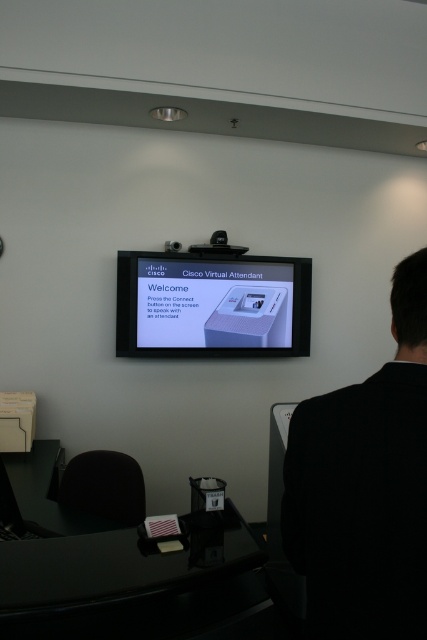
You are setting up a video call in an office and need to position yourself so that both the black fabric back at right and the black glossy table at lower center are visible in the frame. Based on their positions, which side should you stand on to ensure both objects are in view?

You should stand to the left of the black glossy table at lower center so that you can see both the black fabric back at right, which is to the right of the table, and the table itself in the frame.

Consider the image. You are standing in the office and want to determine which of the two points, point [167,323] or point [213,246], is closer to you. Based on the scene description, which point is nearer?

Point [167,323] is closer to the viewer than point [213,246].

You are setting up a presentation and need to know which device has a wider screen between the white glossy monitor at center and the black plastic projector at upper center. Which one is wider?

The white glossy monitor at center has a larger width than the black plastic projector at upper center according to the description.